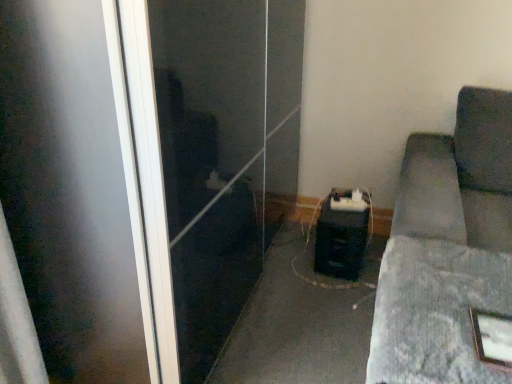
Question: Is black plastic speaker at center, the 2th concrete viewed from the front, to the left or to the right of transparent glass screen door at center in the image?

Choices:
 (A) left
 (B) right

Answer: (B)

Question: From a real-world perspective, is black plastic speaker at center, the 1th concrete from the back, physically located above or below transparent glass screen door at center?

Choices:
 (A) above
 (B) below

Answer: (B)

Question: Considering the real-world distances, which object is farthest from the gray fabric couch at lower right, which is the second concrete from back to front?

Choices:
 (A) dark gray fabric couch at right
 (B) black plastic speaker at center, the 2th concrete viewed from the front
 (C) transparent glass screen door at center
 (D) wooden picture frame at lower right

Answer: (B)

Question: Which of these objects is positioned closest to the transparent glass screen door at center?

Choices:
 (A) dark gray fabric couch at right
 (B) gray fabric couch at lower right, the 1th concrete positioned from the front
 (C) black plastic speaker at center, the 1th concrete from the back
 (D) wooden picture frame at lower right

Answer: (C)